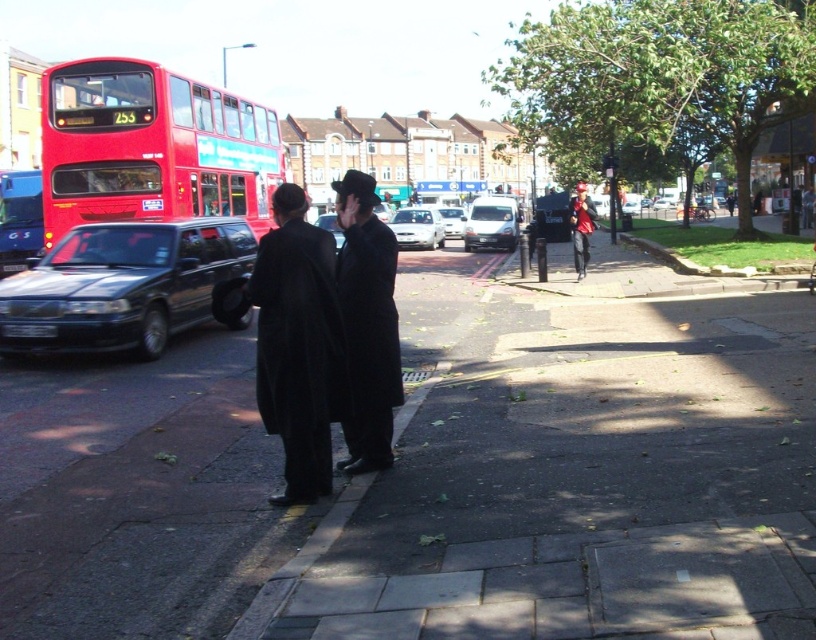
Question: Among these points, which one is nearest to the camera?

Choices:
 (A) (92, 166)
 (B) (457, 236)
 (C) (386, 232)

Answer: (C)

Question: Which point appears closest to the camera in this image?

Choices:
 (A) (366, 384)
 (B) (503, 218)
 (C) (586, 237)

Answer: (A)

Question: Which of these objects is positioned farthest from the red matte double-decker bus at upper left?

Choices:
 (A) shiny black car at center
 (B) matte black coat at center
 (C) black matte coat at center
 (D) silver metallic sedan at center

Answer: (C)

Question: Is matte black coat at center in front of white matte van at center?

Choices:
 (A) yes
 (B) no

Answer: (A)

Question: Observing the image, what is the correct spatial positioning of matte black coat at center in reference to matte black station wagon at left?

Choices:
 (A) right
 (B) left

Answer: (A)

Question: Is white matte van at center positioned in front of red fabric jacket at center?

Choices:
 (A) no
 (B) yes

Answer: (A)